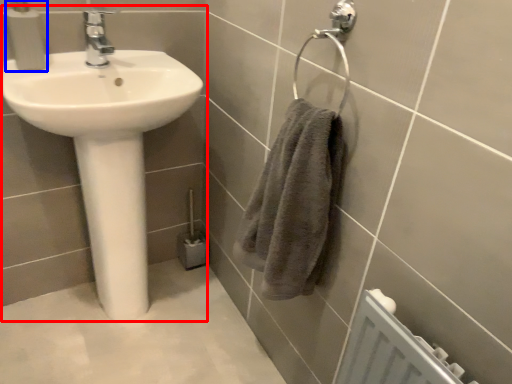
Question: Which point is closer to the camera, sink (highlighted by a red box) or soap dispenser (highlighted by a blue box)?

Choices:
 (A) sink
 (B) soap dispenser

Answer: (A)